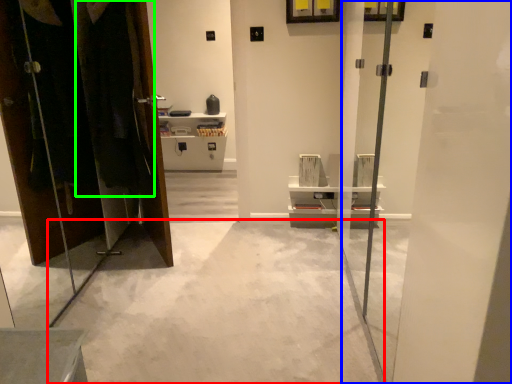
Question: Which object is positioned farthest from concrete (highlighted by a red box)? Select from screen door (highlighted by a blue box) and laundry (highlighted by a green box).

Choices:
 (A) screen door
 (B) laundry

Answer: (B)